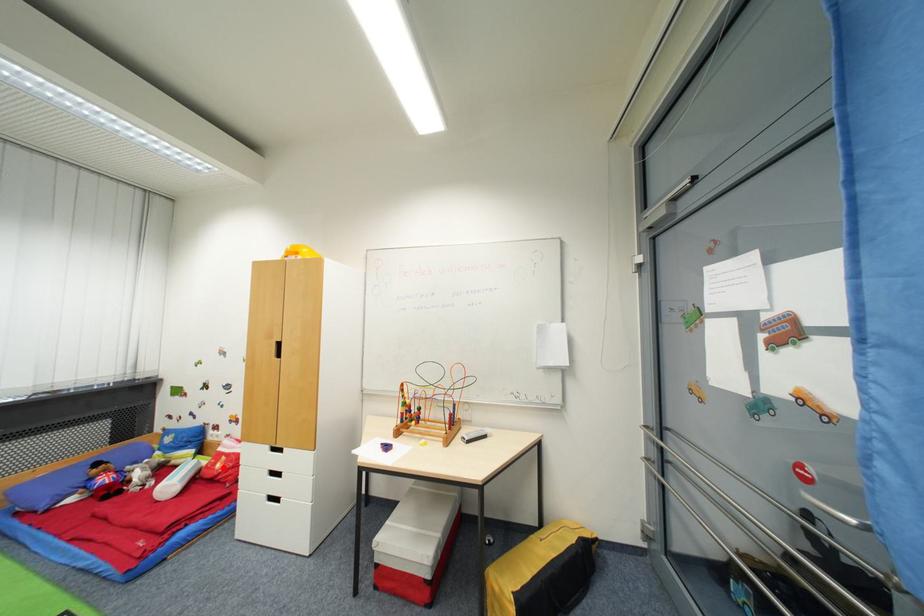
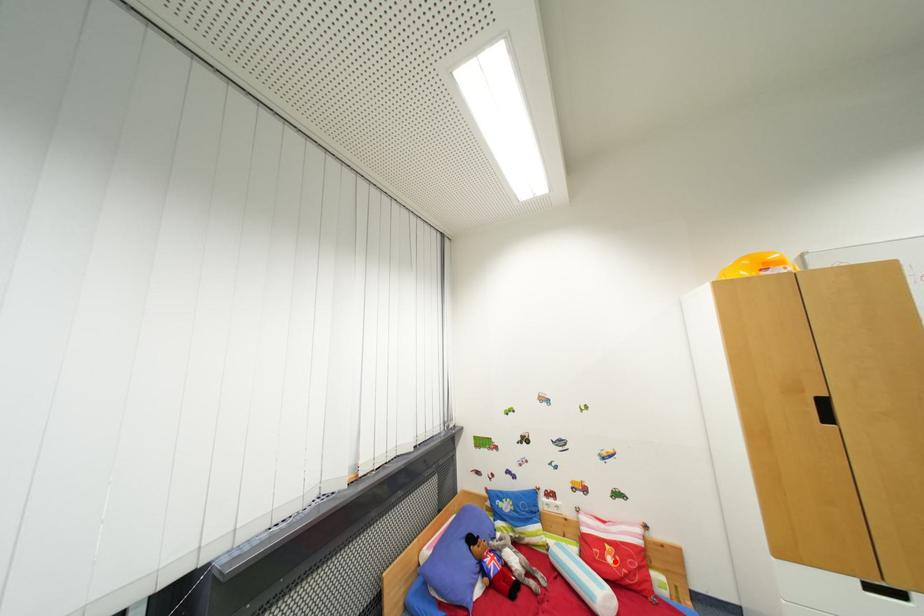
I am providing you with two images of the same scene from different viewpoints. A red point is marked on the first image and another point is marked on the second image. Do the highlighted points in image1 and image2 indicate the same real-world spot?

Yes